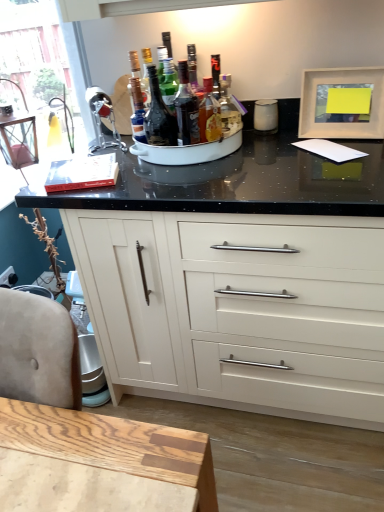
The width and height of the screenshot is (384, 512). Describe the element at coordinates (339, 119) in the screenshot. I see `matte white picture frame at upper right` at that location.

Describe the element at coordinates (159, 116) in the screenshot. I see `translucent glass bottle at center, which is the 1th bottle in left-to-right order` at that location.

I want to click on translucent glass bottle at center, the 3th bottle in the left-to-right sequence, so click(209, 115).

Which of these two, white matte cabinet at center or shiny dark glass bottle at center, the second bottle positioned from the right, is smaller?

shiny dark glass bottle at center, the second bottle positioned from the right, is smaller.

How far apart are white matte cabinet at center and shiny dark glass bottle at center, the second bottle positioned from the right?

white matte cabinet at center is 22.59 inches from shiny dark glass bottle at center, the second bottle positioned from the right.

Identify the location of cabinetry in front of the shiny dark glass bottle at center, marked as the second bottle in a left-to-right arrangement. This screenshot has width=384, height=512. (240, 309).

Between point (81, 261) and point (189, 111), which one is positioned behind?

The point (81, 261) is more distant.

Is shiny dark glass bottle at center, marked as the second bottle in a left-to-right arrangement, turned away from matte white picture frame at upper right?

No, matte white picture frame at upper right is not at the back of shiny dark glass bottle at center, marked as the second bottle in a left-to-right arrangement.

Between shiny dark glass bottle at center, the second bottle positioned from the right, and matte white picture frame at upper right, which one has smaller width?

shiny dark glass bottle at center, the second bottle positioned from the right.

From the image's perspective, would you say shiny dark glass bottle at center, the second bottle positioned from the right, is shown under matte white picture frame at upper right?

Yes, from the image's perspective, shiny dark glass bottle at center, the second bottle positioned from the right, is below matte white picture frame at upper right.

Is shiny dark glass bottle at center, marked as the second bottle in a left-to-right arrangement, directly adjacent to matte white picture frame at upper right?

No.

Is shiny dark glass bottle at center, the second bottle positioned from the right, to the right of translucent glass bottle at center, which is the 1th bottle in left-to-right order, from the viewer's perspective?

Indeed, shiny dark glass bottle at center, the second bottle positioned from the right, is positioned on the right side of translucent glass bottle at center, which is the 1th bottle in left-to-right order.

Consider the image. Is shiny dark glass bottle at center, the second bottle positioned from the right, oriented away from translucent glass bottle at center, which is the 1th bottle in left-to-right order?

No, shiny dark glass bottle at center, the second bottle positioned from the right, is not facing away from translucent glass bottle at center, which is the 1th bottle in left-to-right order.

Is point (181, 77) positioned after point (160, 144)?

Yes, it is behind point (160, 144).

From the image's perspective, which is below, shiny dark glass bottle at center, marked as the second bottle in a left-to-right arrangement, or translucent glass bottle at center, which is the 1th bottle in left-to-right order?

shiny dark glass bottle at center, marked as the second bottle in a left-to-right arrangement, from the image's perspective.

Is translucent glass bottle at center, which is the 3th bottle from right to left, at the back of translucent glass bottle at center, marked as the first bottle in a right-to-left arrangement?

No, translucent glass bottle at center, marked as the first bottle in a right-to-left arrangement, is not facing away from translucent glass bottle at center, which is the 3th bottle from right to left.

Is translucent glass bottle at center, which is the 3th bottle from right to left, surrounded by translucent glass bottle at center, the 3th bottle in the left-to-right sequence?

No.

Considering the sizes of objects translucent glass bottle at center, marked as the first bottle in a right-to-left arrangement, and translucent glass bottle at center, which is the 3th bottle from right to left, in the image provided, who is thinner, translucent glass bottle at center, marked as the first bottle in a right-to-left arrangement, or translucent glass bottle at center, which is the 3th bottle from right to left,?

Thinner between the two is translucent glass bottle at center, marked as the first bottle in a right-to-left arrangement.

Is translucent glass bottle at center, the 3th bottle in the left-to-right sequence, far from translucent glass bottle at center, which is the 3th bottle from right to left?

No, there isn't a large distance between translucent glass bottle at center, the 3th bottle in the left-to-right sequence, and translucent glass bottle at center, which is the 3th bottle from right to left.

Between matte white picture frame at upper right and translucent glass bottle at center, the 3th bottle in the left-to-right sequence, which one is positioned in front?

translucent glass bottle at center, the 3th bottle in the left-to-right sequence, is more forward.

This screenshot has height=512, width=384. What are the coordinates of `picture frame lying behind the translucent glass bottle at center, marked as the first bottle in a right-to-left arrangement` in the screenshot? It's located at (339, 119).

Is translucent glass bottle at center, the 3th bottle in the left-to-right sequence, at the back of matte white picture frame at upper right?

matte white picture frame at upper right does not have its back to translucent glass bottle at center, the 3th bottle in the left-to-right sequence.

Visually, is matte white picture frame at upper right positioned to the left or to the right of translucent glass bottle at center, the 3th bottle in the left-to-right sequence?

Based on their positions, matte white picture frame at upper right is located to the right of translucent glass bottle at center, the 3th bottle in the left-to-right sequence.

Based on the photo, which object is positioned more to the right, white matte cabinet at center or translucent glass bottle at center, which is the 3th bottle from right to left?

Positioned to the right is white matte cabinet at center.

Is white matte cabinet at center situated inside translucent glass bottle at center, which is the 3th bottle from right to left, or outside?

white matte cabinet at center cannot be found inside translucent glass bottle at center, which is the 3th bottle from right to left.

Is white matte cabinet at center oriented away from translucent glass bottle at center, which is the 1th bottle in left-to-right order?

No, white matte cabinet at center's orientation is not away from translucent glass bottle at center, which is the 1th bottle in left-to-right order.

Considering the positions of points (176, 132) and (360, 82), is point (176, 132) closer to camera compared to point (360, 82)?

No, (176, 132) is further to viewer.

From the image's perspective, is translucent glass bottle at center, which is the 1th bottle in left-to-right order, above matte white picture frame at upper right?

No.

Does translucent glass bottle at center, which is the 1th bottle in left-to-right order, have a lesser height compared to matte white picture frame at upper right?

No.

In the scene shown: How different are the orientations of translucent glass bottle at center, which is the 1th bottle in left-to-right order, and matte white picture frame at upper right in degrees?

3.3 degrees.

From the image's perspective, count 2nd bottles upward from the white matte cabinet at center and point to it. Please provide its 2D coordinates.

[(186, 108)]

Starting from the matte white picture frame at upper right, which bottle is the 3rd one in front? Please provide its 2D coordinates.

[(186, 108)]

Based on their spatial positions, is white matte cabinet at center or shiny dark glass bottle at center, marked as the second bottle in a left-to-right arrangement, further from translucent glass bottle at center, marked as the first bottle in a right-to-left arrangement?

white matte cabinet at center.

When comparing their distances from matte white picture frame at upper right, does translucent glass bottle at center, marked as the first bottle in a right-to-left arrangement, or translucent glass bottle at center, which is the 1th bottle in left-to-right order, seem further?

The object further to matte white picture frame at upper right is translucent glass bottle at center, which is the 1th bottle in left-to-right order.

Considering their positions, is shiny dark glass bottle at center, the second bottle positioned from the right, positioned closer to translucent glass bottle at center, which is the 1th bottle in left-to-right order, than matte white picture frame at upper right?

The object closer to translucent glass bottle at center, which is the 1th bottle in left-to-right order, is shiny dark glass bottle at center, the second bottle positioned from the right.

Looking at the image, which one is located further to shiny dark glass bottle at center, marked as the second bottle in a left-to-right arrangement, white matte cabinet at center or translucent glass bottle at center, the 3th bottle in the left-to-right sequence?

white matte cabinet at center is positioned further to the anchor shiny dark glass bottle at center, marked as the second bottle in a left-to-right arrangement.

Based on their spatial positions, is shiny dark glass bottle at center, marked as the second bottle in a left-to-right arrangement, or matte white picture frame at upper right closer to translucent glass bottle at center, the 3th bottle in the left-to-right sequence?

The object closer to translucent glass bottle at center, the 3th bottle in the left-to-right sequence, is shiny dark glass bottle at center, marked as the second bottle in a left-to-right arrangement.

Looking at the image, which one is located further to white matte cabinet at center, translucent glass bottle at center, marked as the first bottle in a right-to-left arrangement, or shiny dark glass bottle at center, marked as the second bottle in a left-to-right arrangement?

The object further to white matte cabinet at center is translucent glass bottle at center, marked as the first bottle in a right-to-left arrangement.

Based on the photo, estimate the real-world distances between objects in this image. Which object is closer to matte white picture frame at upper right, translucent glass bottle at center, marked as the first bottle in a right-to-left arrangement, or white matte cabinet at center?

translucent glass bottle at center, marked as the first bottle in a right-to-left arrangement.

Considering their positions, is translucent glass bottle at center, which is the 3th bottle from right to left, positioned closer to matte white picture frame at upper right than translucent glass bottle at center, the 3th bottle in the left-to-right sequence?

The object closer to matte white picture frame at upper right is translucent glass bottle at center, the 3th bottle in the left-to-right sequence.

Where is `bottle situated between shiny dark glass bottle at center, marked as the second bottle in a left-to-right arrangement, and matte white picture frame at upper right from left to right`? The height and width of the screenshot is (512, 384). bottle situated between shiny dark glass bottle at center, marked as the second bottle in a left-to-right arrangement, and matte white picture frame at upper right from left to right is located at coordinates (209, 115).

This screenshot has height=512, width=384. Identify the location of bottle between translucent glass bottle at center, which is the 3th bottle from right to left, and translucent glass bottle at center, marked as the first bottle in a right-to-left arrangement, from left to right. (186, 108).

Locate an element on the screen. This screenshot has width=384, height=512. bottle between shiny dark glass bottle at center, the second bottle positioned from the right, and white matte cabinet at center vertically is located at coordinates (209, 115).

The height and width of the screenshot is (512, 384). I want to click on cabinetry between translucent glass bottle at center, which is the 1th bottle in left-to-right order, and matte white picture frame at upper right, in the horizontal direction, so click(x=240, y=309).